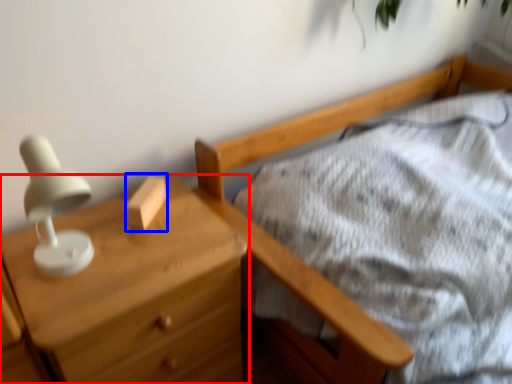
Question: Among these objects, which one is nearest to the camera, chest of drawers (highlighted by a red box) or block (highlighted by a blue box)?

Choices:
 (A) chest of drawers
 (B) block

Answer: (A)